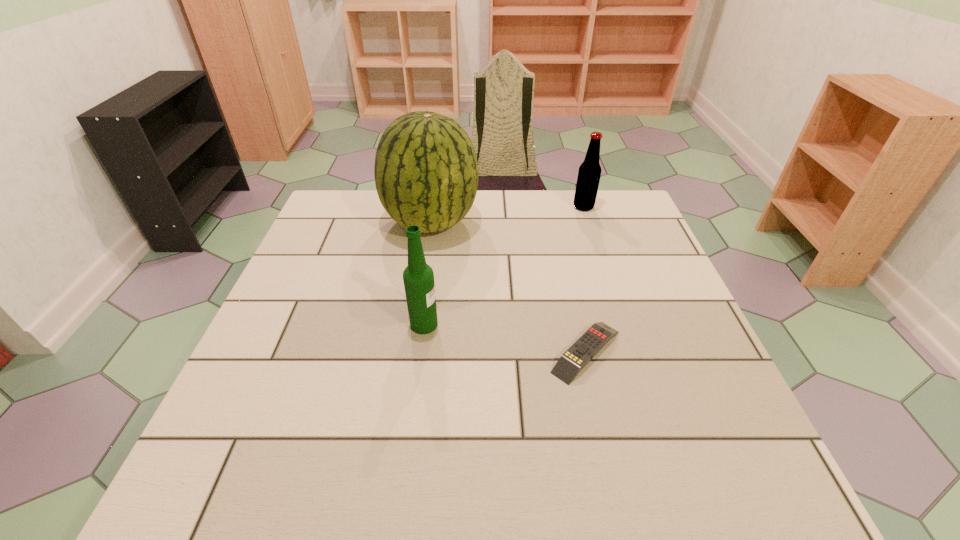
Image resolution: width=960 pixels, height=540 pixels. In order to click on vacant area that lies between the right beer bottle and the shortest object in this screenshot , I will do `click(585, 279)`.

Locate an element on the screen. unoccupied area between the tallest object and the shortest object is located at coordinates (509, 287).

You are a GUI agent. You are given a task and a screenshot of the screen. Output one action in this format:
    pyautogui.click(x=<x>, y=<y>)
    Task: Click on the vacant region between the remote control and the nearer beer bottle
    The height and width of the screenshot is (540, 960).
    Given the screenshot: What is the action you would take?
    pyautogui.click(x=505, y=338)

Identify the location of free area in between the remote control and the nearer beer bottle. (505, 338).

Identify the location of unoccupied area between the remote control and the tallest object. The width and height of the screenshot is (960, 540). (509, 287).

Find the location of a particular element. The image size is (960, 540). vacant point located between the watermelon and the remote control is located at coordinates 509,287.

Locate an element on the screen. The image size is (960, 540). free space between the left beer bottle and the farther beer bottle is located at coordinates (504, 266).

Identify the location of object that is the third closest to the left beer bottle. (589, 173).

Locate which object ranks second in proximity to the nearer beer bottle. Please provide its 2D coordinates. Your answer should be formatted as a tuple, i.e. [(x, y)], where the tuple contains the x and y coordinates of a point satisfying the conditions above.

[(595, 338)]

The width and height of the screenshot is (960, 540). In order to click on vacant space that satisfies the following two spatial constraints: 1. on the label of the remote control; 2. on the left side of the left beer bottle in this screenshot , I will do `click(420, 352)`.